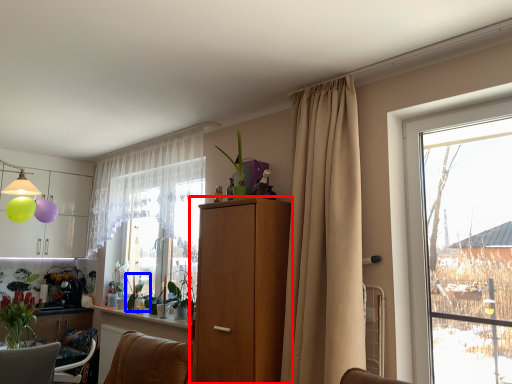
Question: Among these objects, which one is nearest to the camera, cabinetry (highlighted by a red box) or plant (highlighted by a blue box)?

Choices:
 (A) cabinetry
 (B) plant

Answer: (A)